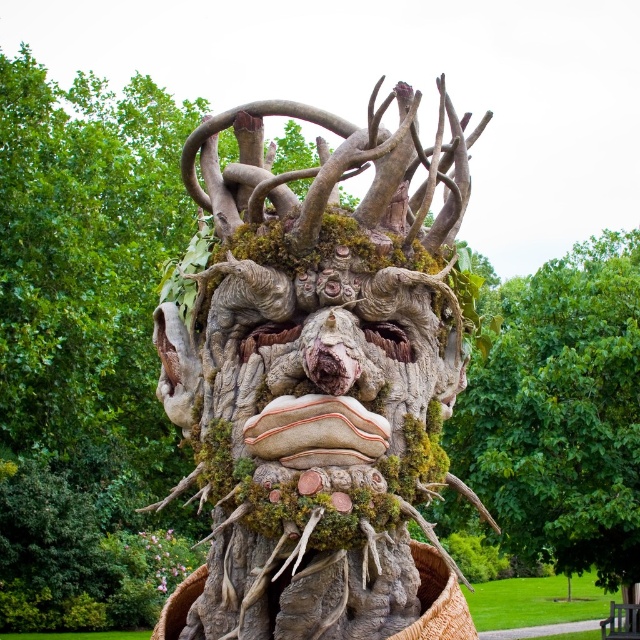
Question: Which point is farther from the camera taking this photo?

Choices:
 (A) (294, 445)
 (B) (532, 557)

Answer: (B)

Question: Does rustic wood sculpture at center appear over mossy bark tree trunk at center?

Choices:
 (A) no
 (B) yes

Answer: (B)

Question: Which object is closer to the camera taking this photo?

Choices:
 (A) rustic wood sculpture at center
 (B) mossy bark tree trunk at center

Answer: (A)

Question: Can you confirm if rustic wood sculpture at center is thinner than mossy bark tree trunk at center?

Choices:
 (A) no
 (B) yes

Answer: (B)

Question: Does rustic wood sculpture at center have a smaller size compared to mossy bark tree trunk at center?

Choices:
 (A) yes
 (B) no

Answer: (B)